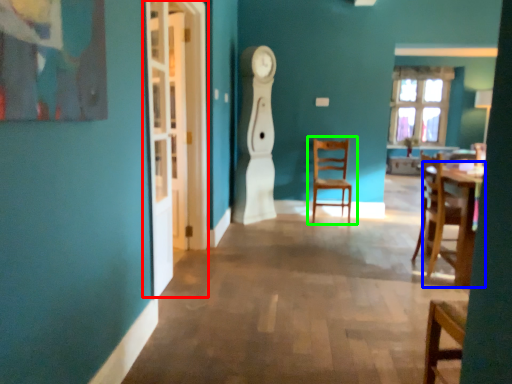
Question: Based on their relative distances, which object is nearer to glass door (highlighted by a red box)? Choose from table (highlighted by a blue box) and chair (highlighted by a green box).

Choices:
 (A) table
 (B) chair

Answer: (A)